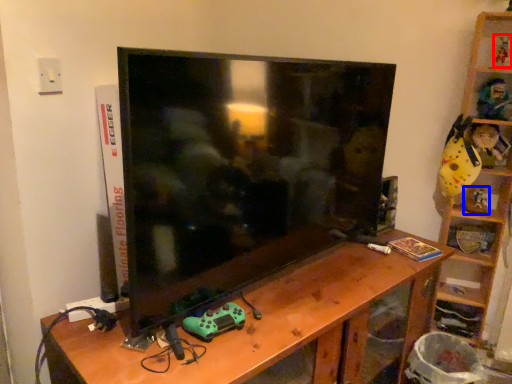
Question: Which object appears farthest to the camera in this image, toy (highlighted by a red box) or toy (highlighted by a blue box)?

Choices:
 (A) toy
 (B) toy

Answer: (B)